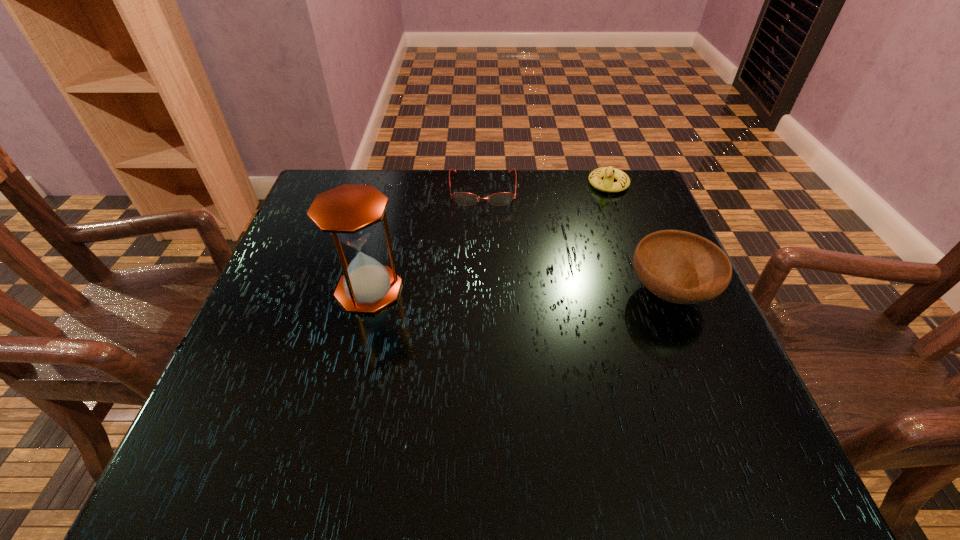
Find the location of a particular element. free space that satisfies the following two spatial constraints: 1. on the back side of the shortest object; 2. on the left side of the leftmost object is located at coordinates (394, 189).